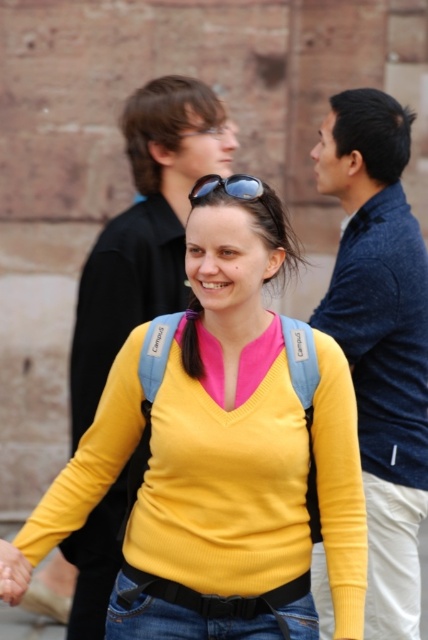
Is jeans at center taller than sunglasses at center?

Yes.

I want to click on jeans at center, so click(x=207, y=611).

Does yellow ribbed sweater at center have a lesser height compared to matte black jacket at upper left?

Correct, yellow ribbed sweater at center is not as tall as matte black jacket at upper left.

Consider the image. Is yellow ribbed sweater at center wider than matte black jacket at upper left?

Yes, yellow ribbed sweater at center is wider than matte black jacket at upper left.

Does point (282, 529) come behind point (104, 257)?

No.

Locate an element on the screen. Image resolution: width=428 pixels, height=640 pixels. yellow ribbed sweater at center is located at coordinates (222, 452).

Is the position of matte black jacket at upper left less distant than that of sunglasses at center?

No, it is behind sunglasses at center.

Is matte black jacket at upper left below sunglasses at center?

Yes.

Who is more distant from viewer, (x=113, y=490) or (x=217, y=180)?

Positioned behind is point (x=113, y=490).

Where is `matte black jacket at upper left`? This screenshot has height=640, width=428. matte black jacket at upper left is located at coordinates (145, 228).